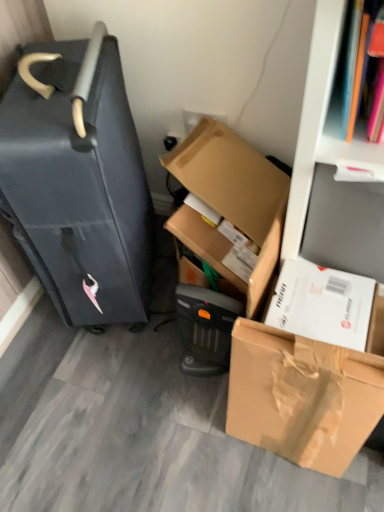
What is the approximate width of brown cardboard box at lower right, the second box positioned from the top?

4.59 inches.

Identify the location of cardboard box at center, which ranks as the 2th box in bottom-to-top order. This screenshot has height=512, width=384. coord(230,202).

From the image's perspective, is white cardboard bookshelf at upper right located beneath cardboard box at center, which is the first box in top-to-bottom order?

No, from the image's perspective, white cardboard bookshelf at upper right is not below cardboard box at center, which is the first box in top-to-bottom order.

Between white cardboard bookshelf at upper right and cardboard box at center, which is the first box in top-to-bottom order, which one has larger size?

white cardboard bookshelf at upper right is bigger.

Which of these two, white cardboard bookshelf at upper right or cardboard box at center, which is the first box in top-to-bottom order, stands taller?

With more height is white cardboard bookshelf at upper right.

Does brown cardboard box at lower right, the second box positioned from the top, lie in front of cardboard box at center, which ranks as the 2th box in bottom-to-top order?

Yes, brown cardboard box at lower right, the second box positioned from the top, is in front of cardboard box at center, which ranks as the 2th box in bottom-to-top order.

Is brown cardboard box at lower right, which is the first box in bottom-to-top order, wider than cardboard box at center, which is the first box in top-to-bottom order?

No.

From a real-world perspective, who is located higher, brown cardboard box at lower right, the second box positioned from the top, or cardboard box at center, which is the first box in top-to-bottom order?

From a 3D spatial view, cardboard box at center, which is the first box in top-to-bottom order, is above.

From a real-world perspective, is cardboard box at center, which is the first box in top-to-bottom order, on top of brown cardboard box at lower right, which is the first box in bottom-to-top order?

Yes, from a real-world perspective, cardboard box at center, which is the first box in top-to-bottom order, is above brown cardboard box at lower right, which is the first box in bottom-to-top order.

Is cardboard box at center, which ranks as the 2th box in bottom-to-top order, inside or outside of brown cardboard box at lower right, the second box positioned from the top?

cardboard box at center, which ranks as the 2th box in bottom-to-top order, is located beyond the bounds of brown cardboard box at lower right, the second box positioned from the top.

This screenshot has width=384, height=512. I want to click on box below the cardboard box at center, which ranks as the 2th box in bottom-to-top order (from the image's perspective), so (305, 393).

Considering the sizes of objects cardboard box at center, which ranks as the 2th box in bottom-to-top order, and brown cardboard box at lower right, which is the first box in bottom-to-top order, in the image provided, who is shorter, cardboard box at center, which ranks as the 2th box in bottom-to-top order, or brown cardboard box at lower right, which is the first box in bottom-to-top order,?

With less height is cardboard box at center, which ranks as the 2th box in bottom-to-top order.

Which is correct: white cardboard bookshelf at upper right is inside matte black suitcase at left, or outside of it?

white cardboard bookshelf at upper right is not inside matte black suitcase at left, it's outside.

Locate an element on the screen. bookshelf above the matte black suitcase at left (from the image's perspective) is located at coordinates (335, 178).

Does white cardboard bookshelf at upper right have a greater width compared to matte black suitcase at left?

Indeed, white cardboard bookshelf at upper right has a greater width compared to matte black suitcase at left.

How many degrees apart are the facing directions of white cardboard bookshelf at upper right and matte black suitcase at left?

110 degrees separate the facing orientations of white cardboard bookshelf at upper right and matte black suitcase at left.

Does cardboard box at center, which ranks as the 2th box in bottom-to-top order, have a lesser height compared to matte black suitcase at left?

Yes, cardboard box at center, which ranks as the 2th box in bottom-to-top order, is shorter than matte black suitcase at left.

Where is `box behind the matte black suitcase at left`? The width and height of the screenshot is (384, 512). box behind the matte black suitcase at left is located at coordinates (230, 202).

Is cardboard box at center, which ranks as the 2th box in bottom-to-top order, looking in the opposite direction of matte black suitcase at left?

That's not correct — cardboard box at center, which ranks as the 2th box in bottom-to-top order, is not looking away from matte black suitcase at left.

Would you say cardboard box at center, which ranks as the 2th box in bottom-to-top order, is inside or outside matte black suitcase at left?

cardboard box at center, which ranks as the 2th box in bottom-to-top order, is located beyond the bounds of matte black suitcase at left.

From the picture: What's the angular difference between cardboard box at center, which ranks as the 2th box in bottom-to-top order, and white cardboard bookshelf at upper right's facing directions?

They differ by 0.000304 degrees in their facing directions.

From a real-world perspective, relative to white cardboard bookshelf at upper right, is cardboard box at center, which is the first box in top-to-bottom order, vertically above or below?

Clearly, from a real-world perspective, cardboard box at center, which is the first box in top-to-bottom order, is below white cardboard bookshelf at upper right.

Is cardboard box at center, which is the first box in top-to-bottom order, next to white cardboard bookshelf at upper right?

No.

Considering the sizes of objects cardboard box at center, which ranks as the 2th box in bottom-to-top order, and white cardboard bookshelf at upper right in the image provided, who is bigger, cardboard box at center, which ranks as the 2th box in bottom-to-top order, or white cardboard bookshelf at upper right?

white cardboard bookshelf at upper right.

Does matte black suitcase at left have a smaller size compared to brown cardboard box at lower right, which is the first box in bottom-to-top order?

No.

Based on the photo, which object is positioned more to the left, matte black suitcase at left or brown cardboard box at lower right, which is the first box in bottom-to-top order?

Positioned to the left is matte black suitcase at left.

Which is correct: matte black suitcase at left is inside brown cardboard box at lower right, which is the first box in bottom-to-top order, or outside of it?

matte black suitcase at left is not enclosed by brown cardboard box at lower right, which is the first box in bottom-to-top order.

From the image's perspective, who appears lower, matte black suitcase at left or brown cardboard box at lower right, which is the first box in bottom-to-top order?

brown cardboard box at lower right, which is the first box in bottom-to-top order.

Locate an element on the screen. bookshelf above the cardboard box at center, which is the first box in top-to-bottom order (from the image's perspective) is located at coordinates (335, 178).

In order to click on box below the cardboard box at center, which ranks as the 2th box in bottom-to-top order (from a real-world perspective) in this screenshot , I will do `click(305, 393)`.

Looking at the image, which one is located further to matte black suitcase at left, white cardboard bookshelf at upper right or cardboard box at center, which is the first box in top-to-bottom order?

white cardboard bookshelf at upper right.

Considering their positions, is white cardboard bookshelf at upper right positioned closer to cardboard box at center, which ranks as the 2th box in bottom-to-top order, than matte black suitcase at left?

white cardboard bookshelf at upper right.

Which object lies further to the anchor point cardboard box at center, which ranks as the 2th box in bottom-to-top order, white cardboard bookshelf at upper right or brown cardboard box at lower right, which is the first box in bottom-to-top order?

brown cardboard box at lower right, which is the first box in bottom-to-top order, is further to cardboard box at center, which ranks as the 2th box in bottom-to-top order.

Based on their spatial positions, is brown cardboard box at lower right, the second box positioned from the top, or cardboard box at center, which is the first box in top-to-bottom order, closer to matte black suitcase at left?

Based on the image, cardboard box at center, which is the first box in top-to-bottom order, appears to be nearer to matte black suitcase at left.

Looking at the image, which one is located closer to brown cardboard box at lower right, the second box positioned from the top, matte black suitcase at left or white cardboard bookshelf at upper right?

Among the two, white cardboard bookshelf at upper right is located nearer to brown cardboard box at lower right, the second box positioned from the top.

From the image, which object appears to be nearer to cardboard box at center, which ranks as the 2th box in bottom-to-top order, brown cardboard box at lower right, which is the first box in bottom-to-top order, or matte black suitcase at left?

matte black suitcase at left is positioned closer to the anchor cardboard box at center, which ranks as the 2th box in bottom-to-top order.

Based on their spatial positions, is matte black suitcase at left or cardboard box at center, which ranks as the 2th box in bottom-to-top order, closer to white cardboard bookshelf at upper right?

cardboard box at center, which ranks as the 2th box in bottom-to-top order, is positioned closer to the anchor white cardboard bookshelf at upper right.

When comparing their distances from cardboard box at center, which ranks as the 2th box in bottom-to-top order, does brown cardboard box at lower right, which is the first box in bottom-to-top order, or white cardboard bookshelf at upper right seem closer?

Based on the image, white cardboard bookshelf at upper right appears to be nearer to cardboard box at center, which ranks as the 2th box in bottom-to-top order.

Where is `box that lies between white cardboard bookshelf at upper right and brown cardboard box at lower right, the second box positioned from the top, from top to bottom`? box that lies between white cardboard bookshelf at upper right and brown cardboard box at lower right, the second box positioned from the top, from top to bottom is located at coordinates (230, 202).

The image size is (384, 512). I want to click on box between matte black suitcase at left and brown cardboard box at lower right, the second box positioned from the top, in the up-down direction, so click(x=230, y=202).